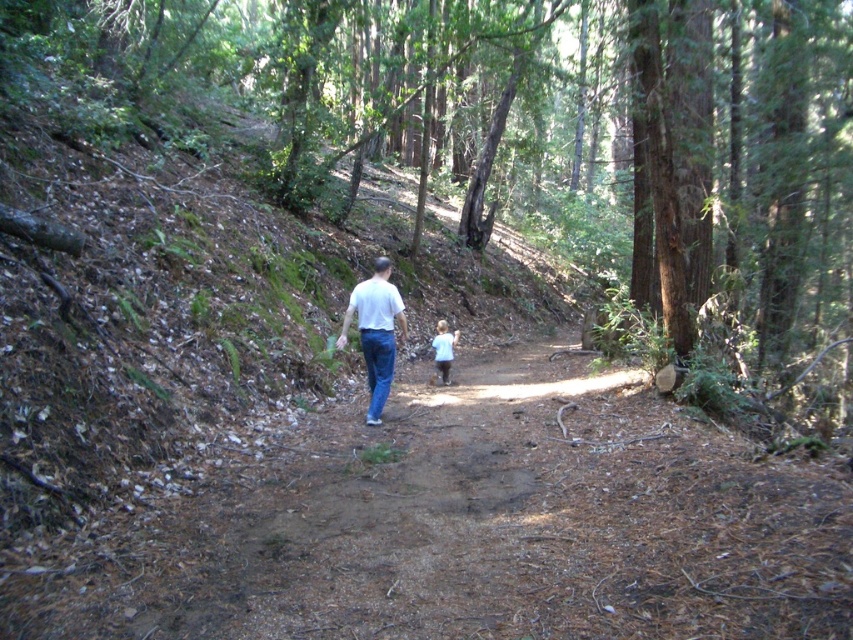
Is blue denim jeans at center below light brown hair at center?

Indeed, blue denim jeans at center is positioned under light brown hair at center.

Locate an element on the screen. blue denim jeans at center is located at coordinates (376, 368).

Does point (339, 333) come closer to viewer compared to point (370, 378)?

No.

Consider the image. Who is more distant from viewer, (372,378) or (381,410)?

Positioned behind is point (372,378).

Where is `white matte shirt at center`? This screenshot has width=853, height=640. white matte shirt at center is located at coordinates (375, 332).

Can you confirm if white matte shirt at center is wider than light brown hair at center?

Indeed, white matte shirt at center has a greater width compared to light brown hair at center.

Can you confirm if white matte shirt at center is bigger than light brown hair at center?

Yes.

Describe the element at coordinates (375, 332) in the screenshot. I see `white matte shirt at center` at that location.

This screenshot has height=640, width=853. I want to click on white matte shirt at center, so click(375, 332).